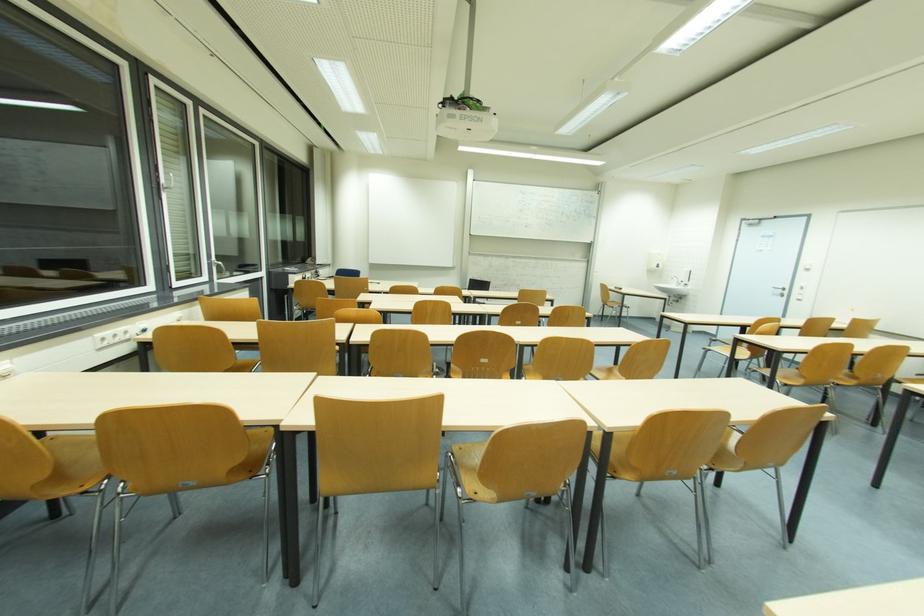
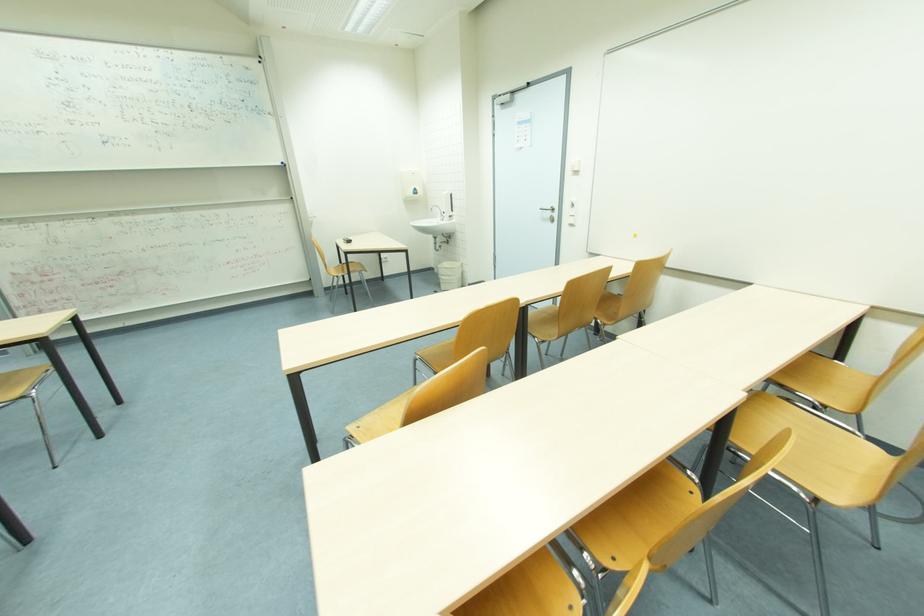
Which direction would the cameraman need to move to produce the second image?

The cameraman walked toward right, forward.